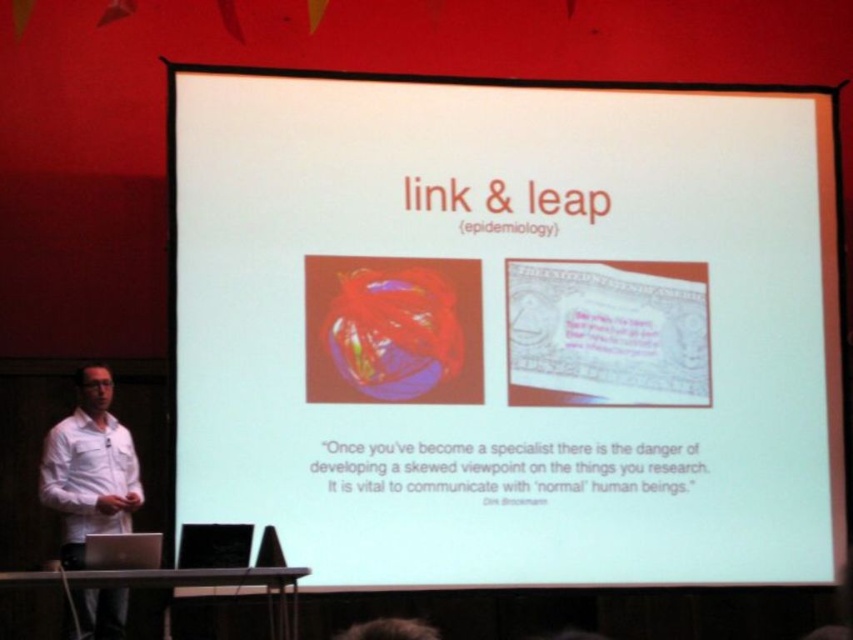
Who is positioned more to the right, white paper at center or white shirt at left?

From the viewer's perspective, white paper at center appears more on the right side.

Between point (581, 348) and point (99, 449), which one is positioned in front?

Positioned in front is point (99, 449).

Identify the location of white paper at center. This screenshot has height=640, width=853. (508, 328).